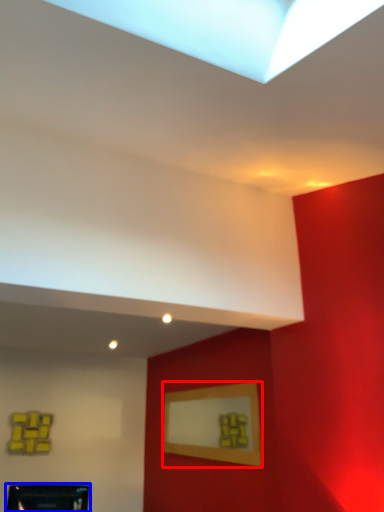
Question: Which object appears farthest to the camera in this image, picture frame (highlighted by a red box) or picture frame (highlighted by a blue box)?

Choices:
 (A) picture frame
 (B) picture frame

Answer: (A)